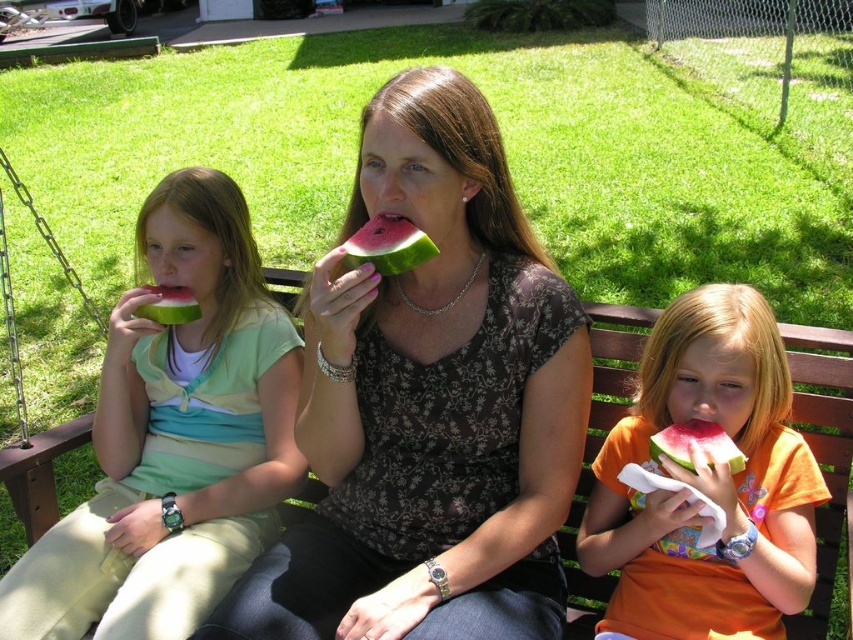
You are a photographer standing in the backyard and want to capture a photo of the metallic chain at left and the pink flesh watermelon at lower right without any obstructions. Based on their positions, which object is blocking the view of the other?

The metallic chain at left is positioned over the pink flesh watermelon at lower right, so the metallic chain at left is blocking the view of the pink flesh watermelon at lower right.

You are a bee that just flew from a flower garden. You see the watermelon at center and the pink flesh watermelon at lower right. Which one is closer to you?

The watermelon at center is closer to you because it is only 25.17 inches away from the pink flesh watermelon at lower right, but the question does not specify your exact position. However, since the pink flesh watermelon is at lower right and the watermelon is at center, the watermelon at center is likely closer to the bee coming from the flower garden unless the bee is positioned closer to the lower right.